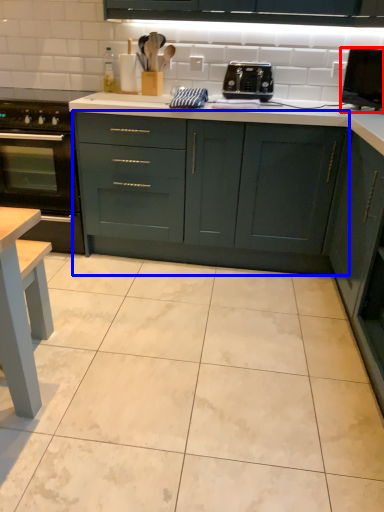
Question: Which of the following is the closest to the observer, appliance (highlighted by a red box) or cabinetry (highlighted by a blue box)?

Choices:
 (A) appliance
 (B) cabinetry

Answer: (A)